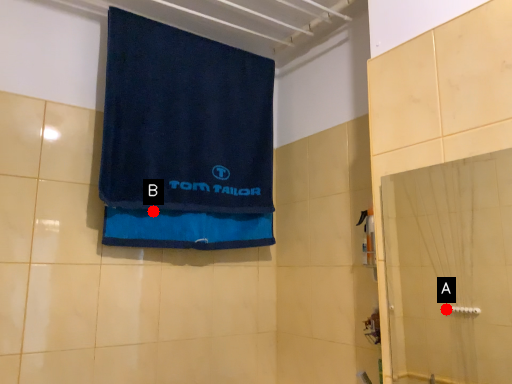
Question: Two points are circled on the image, labeled by A and B beside each circle. Which point is further to the camera?

Choices:
 (A) A is further
 (B) B is further

Answer: (A)